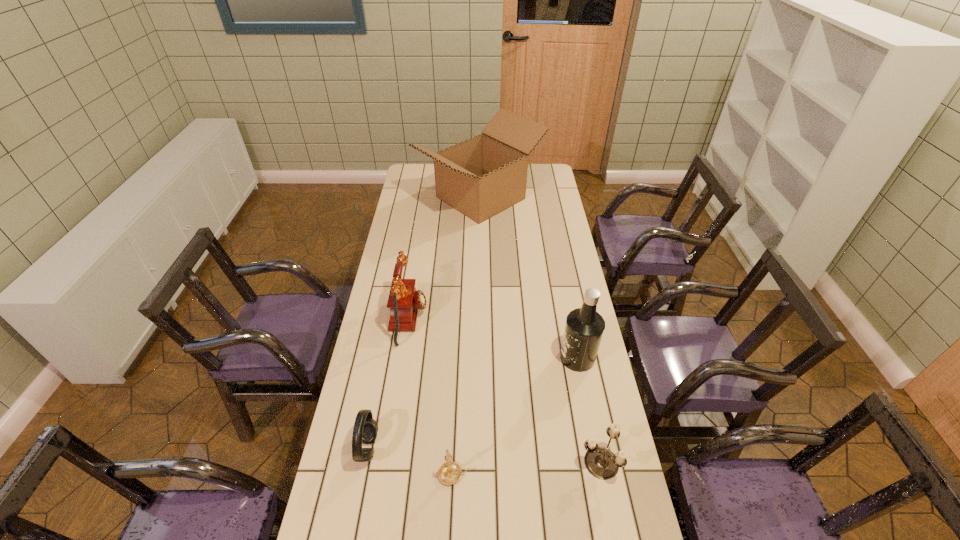
Identify the location of free space between the fourth shortest object and the left candle holder. (431, 397).

This screenshot has width=960, height=540. What are the coordinates of `the second closest object relative to the farthest object` in the screenshot? It's located at (584, 328).

Where is `object that is the second closest to the headset`? Image resolution: width=960 pixels, height=540 pixels. object that is the second closest to the headset is located at coordinates (404, 301).